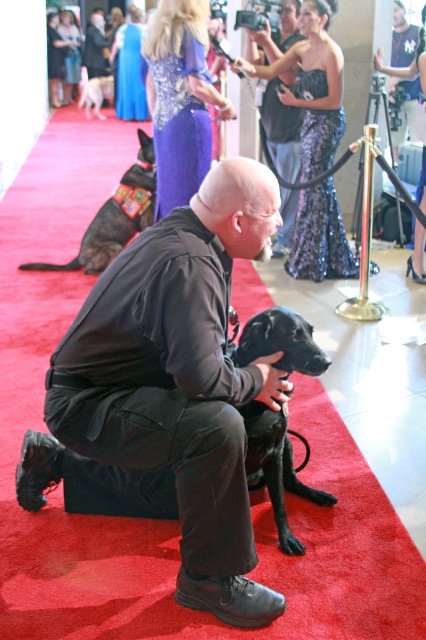
Question: Among these points, which one is nearest to the camera?

Choices:
 (A) (187, 602)
 (B) (411, 60)
 (C) (152, 144)
 (D) (282, 420)

Answer: (A)

Question: Can you confirm if black matte jacket at center is wider than matte black shirt at center?

Choices:
 (A) no
 (B) yes

Answer: (B)

Question: Does black leather vest at center appear on the right side of white fur dog at upper left?

Choices:
 (A) no
 (B) yes

Answer: (B)

Question: Does black matte jacket at center have a greater width compared to black leather vest at center?

Choices:
 (A) no
 (B) yes

Answer: (A)

Question: Which of the following is the closest to the observer?

Choices:
 (A) white fur dog at upper left
 (B) black leather vest at center

Answer: (B)

Question: Which of the following is the closest to the observer?

Choices:
 (A) matte black shirt at center
 (B) black matte dog at center

Answer: (B)